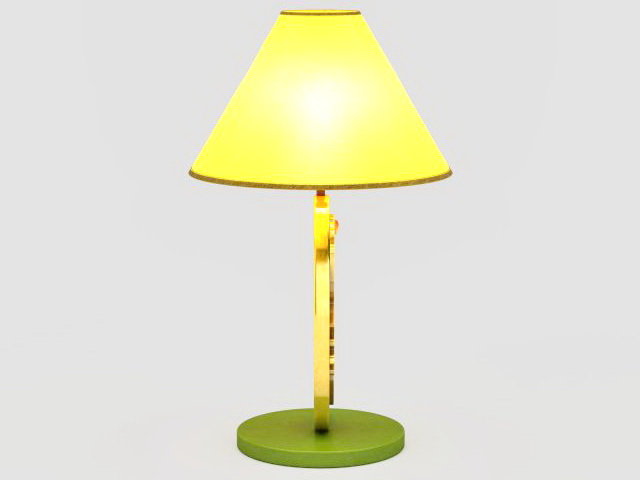
At what (x,y) coordinates should I click in order to perform the action: click on lampshade. Please return your answer as a coordinate pair (x, y). Looking at the image, I should click on (310, 120).